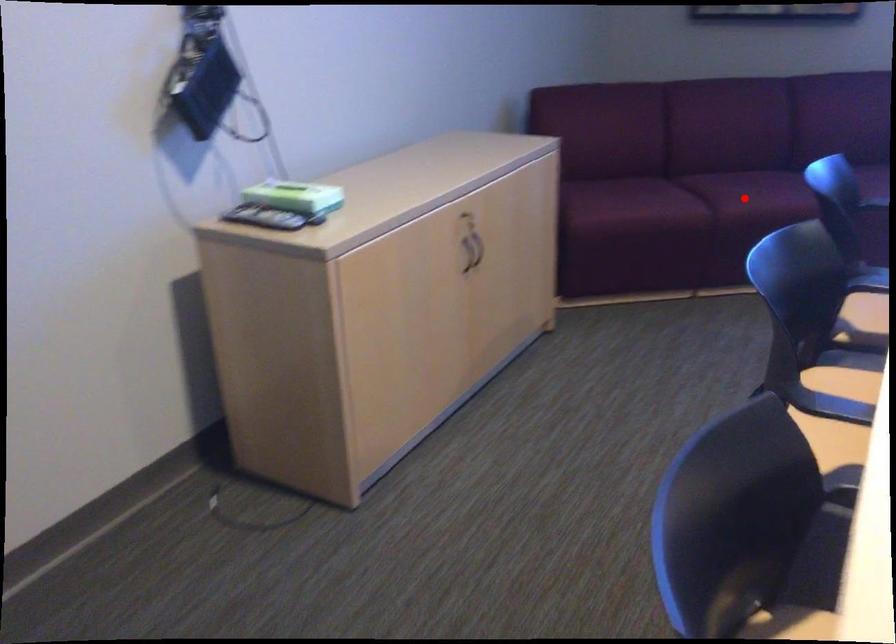
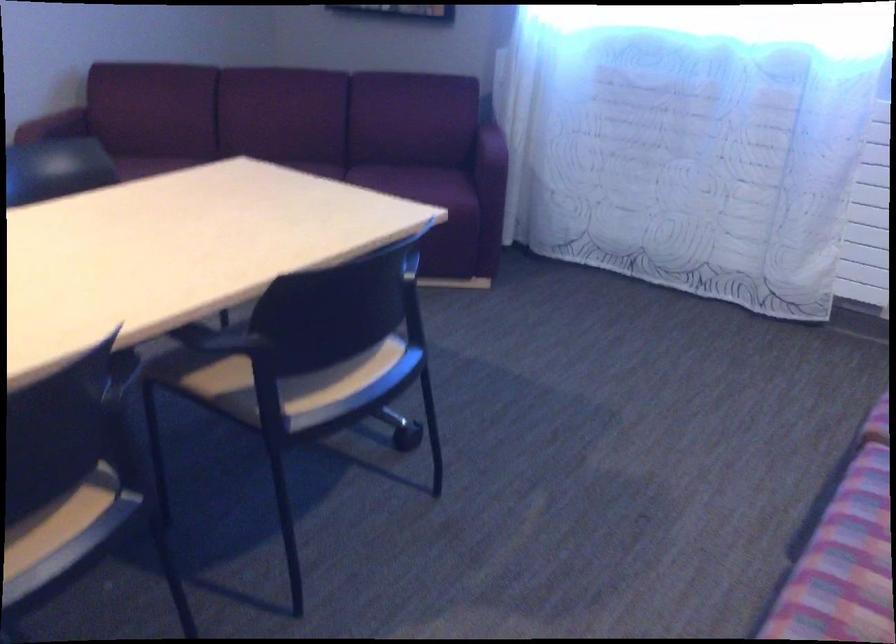
Question: I am providing you with two images of the same scene from different viewpoints. A red point is marked on the first image. At the location where the point appears in image 1, is it still visible in image 2?

Choices:
 (A) Yes
 (B) No

Answer: (B)